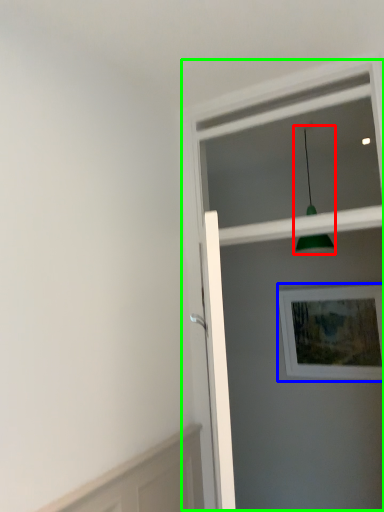
Question: Considering the real-world distances, which object is farthest from light fixture (highlighted by a red box)? picture frame (highlighted by a blue box) or screen door (highlighted by a green box)?

Choices:
 (A) picture frame
 (B) screen door

Answer: (B)